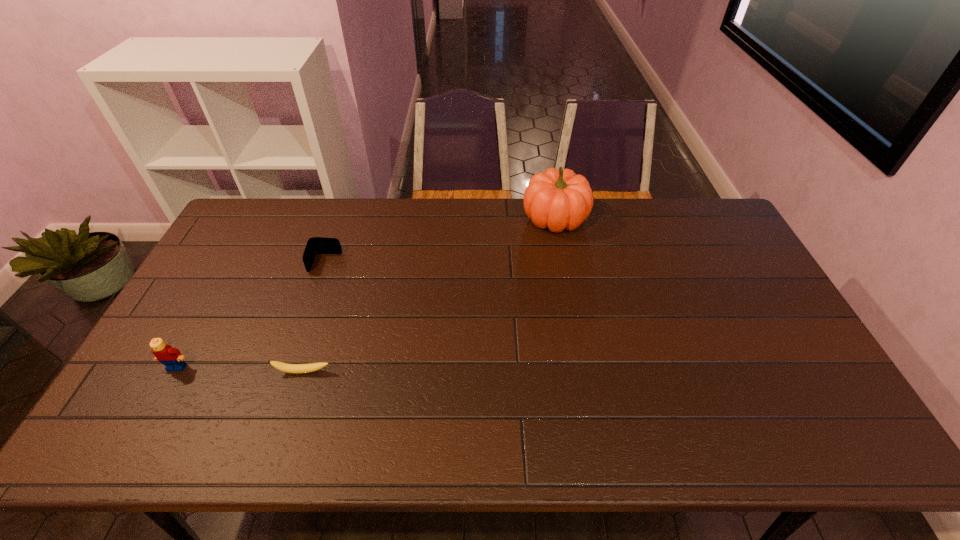
Identify the location of the rightmost object. Image resolution: width=960 pixels, height=540 pixels. (559, 200).

At what (x,y) coordinates should I click in order to perform the action: click on the tallest object. Please return your answer as a coordinate pair (x, y). Looking at the image, I should click on (559, 200).

Locate an element on the screen. The height and width of the screenshot is (540, 960). the leftmost object is located at coordinates (171, 357).

Image resolution: width=960 pixels, height=540 pixels. Identify the location of the second tallest object. (171, 357).

Where is `the second farthest object`? The height and width of the screenshot is (540, 960). the second farthest object is located at coordinates (316, 245).

At what (x,y) coordinates should I click in order to perform the action: click on the second shortest object. Please return your answer as a coordinate pair (x, y). Looking at the image, I should click on (316, 245).

At what (x,y) coordinates should I click in order to perform the action: click on the shortest object. Please return your answer as a coordinate pair (x, y). This screenshot has height=540, width=960. Looking at the image, I should click on (312, 367).

Identify the location of vacant space located 0.220m on the right of the pumpkin. This screenshot has width=960, height=540. 648,218.

Identify the location of free region located on the front-facing side of the leftmost object. This screenshot has width=960, height=540. (x=158, y=400).

At what (x,y) coordinates should I click in order to perform the action: click on vacant area situated on the outer surface of the wallet. Please return your answer as a coordinate pair (x, y). Looking at the image, I should click on (311, 306).